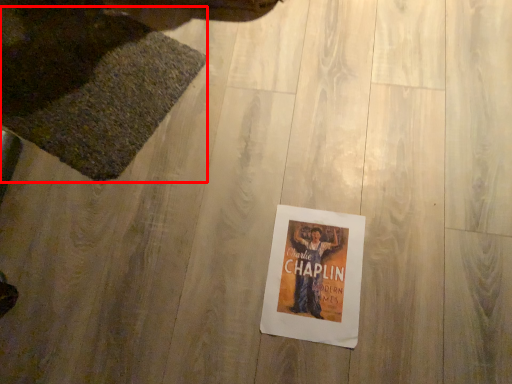
Question: In this image, where is mat (annotated by the red box) located relative to poster?

Choices:
 (A) right
 (B) left

Answer: (B)